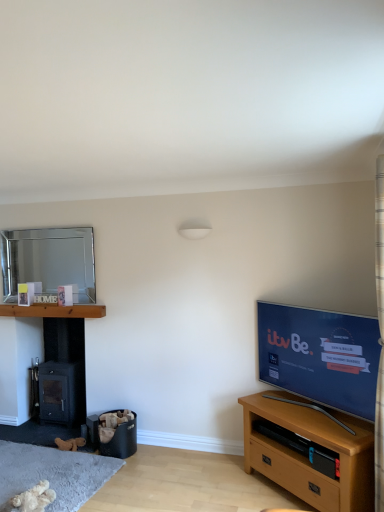
Question: Is light brown wooden tv stand at lower right wider than plaid fabric curtain at upper right?

Choices:
 (A) yes
 (B) no

Answer: (A)

Question: Does light brown wooden tv stand at lower right come behind plaid fabric curtain at upper right?

Choices:
 (A) no
 (B) yes

Answer: (B)

Question: Is light brown wooden tv stand at lower right surrounding plaid fabric curtain at upper right?

Choices:
 (A) yes
 (B) no

Answer: (B)

Question: Could you tell me if light brown wooden tv stand at lower right is facing plaid fabric curtain at upper right?

Choices:
 (A) yes
 (B) no

Answer: (B)

Question: Does light brown wooden tv stand at lower right appear on the left side of plaid fabric curtain at upper right?

Choices:
 (A) no
 (B) yes

Answer: (B)

Question: Does light brown wooden tv stand at lower right appear on the right side of plaid fabric curtain at upper right?

Choices:
 (A) no
 (B) yes

Answer: (A)

Question: From a real-world perspective, is fluffy beige teddy bear at lower left below matte black tv at right?

Choices:
 (A) yes
 (B) no

Answer: (A)

Question: Can you confirm if fluffy beige teddy bear at lower left is thinner than matte black tv at right?

Choices:
 (A) yes
 (B) no

Answer: (B)

Question: Is fluffy beige teddy bear at lower left to the right of matte black tv at right from the viewer's perspective?

Choices:
 (A) yes
 (B) no

Answer: (B)

Question: Is fluffy beige teddy bear at lower left wider than matte black tv at right?

Choices:
 (A) yes
 (B) no

Answer: (A)

Question: Are fluffy beige teddy bear at lower left and matte black tv at right making contact?

Choices:
 (A) no
 (B) yes

Answer: (A)

Question: Is fluffy beige teddy bear at lower left surrounding matte black tv at right?

Choices:
 (A) yes
 (B) no

Answer: (B)

Question: From the image's perspective, is silver metallic mirror at upper left below wooden at left, which is the 2th shelf in bottom-to-top order?

Choices:
 (A) yes
 (B) no

Answer: (B)